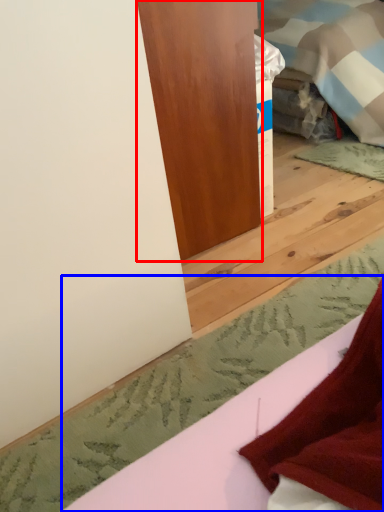
Question: Which object appears farthest to the camera in this image, furniture (highlighted by a red box) or sheet (highlighted by a blue box)?

Choices:
 (A) furniture
 (B) sheet

Answer: (A)